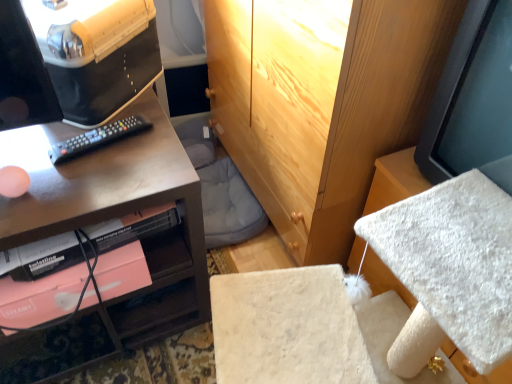
The width and height of the screenshot is (512, 384). Identify the location of vacant space situated on the left part of black plastic remote at left. (44, 143).